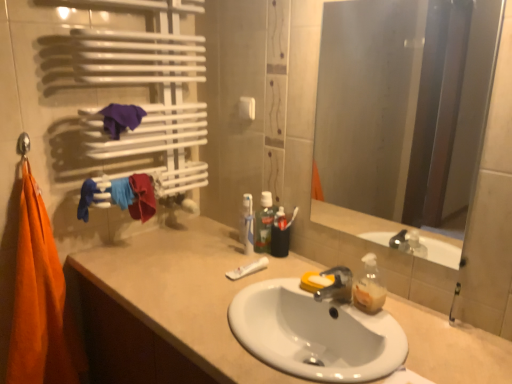
Find the location of a particular element. This screenshot has height=384, width=512. vacant space to the left of white matte toothpaste at center is located at coordinates (201, 270).